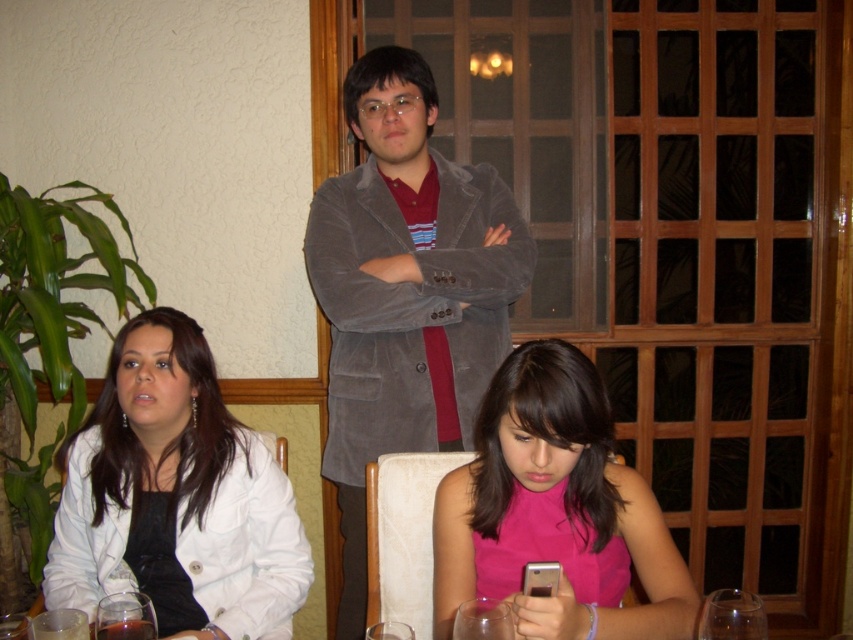
Question: Among these points, which one is nearest to the camera?

Choices:
 (A) (477, 552)
 (B) (390, 88)
 (C) (254, 474)

Answer: (A)

Question: Is suede blazer at center positioned behind pink satin dress at center?

Choices:
 (A) yes
 (B) no

Answer: (A)

Question: Estimate the real-world distances between objects in this image. Which object is farther from the pink satin dress at center?

Choices:
 (A) suede blazer at center
 (B) white matte jacket at lower left

Answer: (A)

Question: Can you confirm if suede blazer at center is positioned to the right of pink satin dress at center?

Choices:
 (A) no
 (B) yes

Answer: (A)

Question: Which object appears closest to the camera in this image?

Choices:
 (A) suede blazer at center
 (B) pink satin dress at center
 (C) white matte jacket at lower left

Answer: (B)

Question: Is suede blazer at center smaller than pink satin dress at center?

Choices:
 (A) yes
 (B) no

Answer: (B)